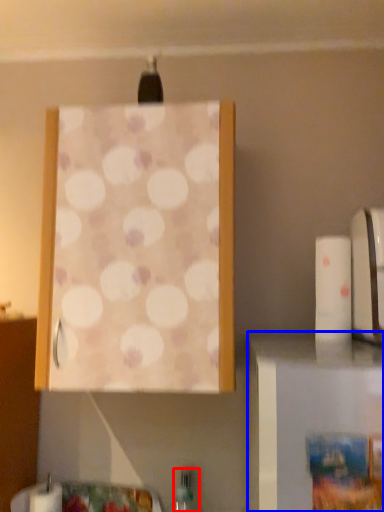
Question: Which point is closer to the camera, bottle (highlighted by a red box) or furniture (highlighted by a blue box)?

Choices:
 (A) bottle
 (B) furniture

Answer: (B)